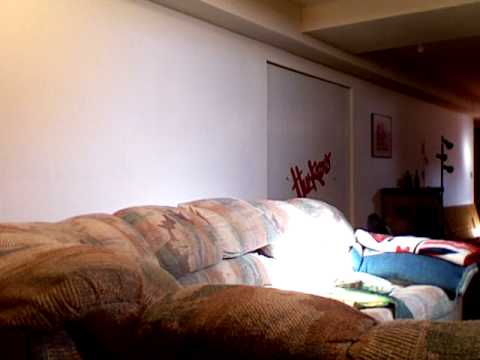
The width and height of the screenshot is (480, 360). Find the location of `left side of couch`. left side of couch is located at coordinates (301, 230).